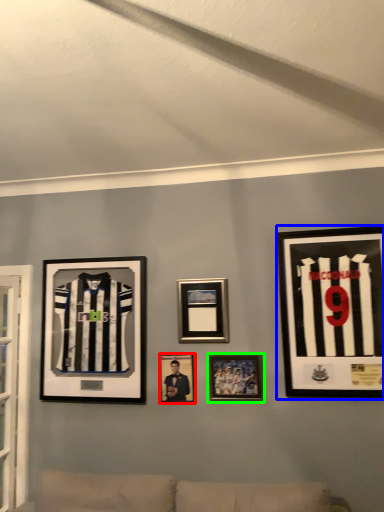
Question: Which object is positioned closest to picture frame (highlighted by a red box)? Select from picture frame (highlighted by a blue box) and picture frame (highlighted by a green box).

Choices:
 (A) picture frame
 (B) picture frame

Answer: (B)